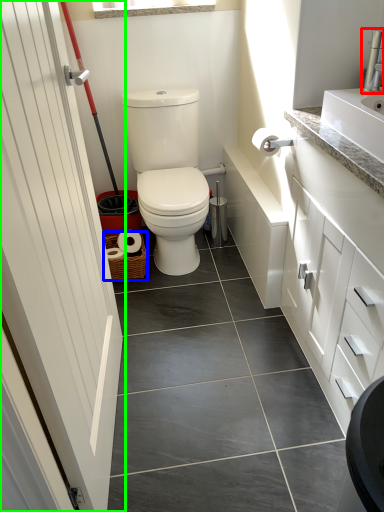
Question: Considering the real-world distances, which object is closest to faucet (highlighted by a red box)? basket (highlighted by a blue box) or door (highlighted by a green box).

Choices:
 (A) basket
 (B) door

Answer: (B)